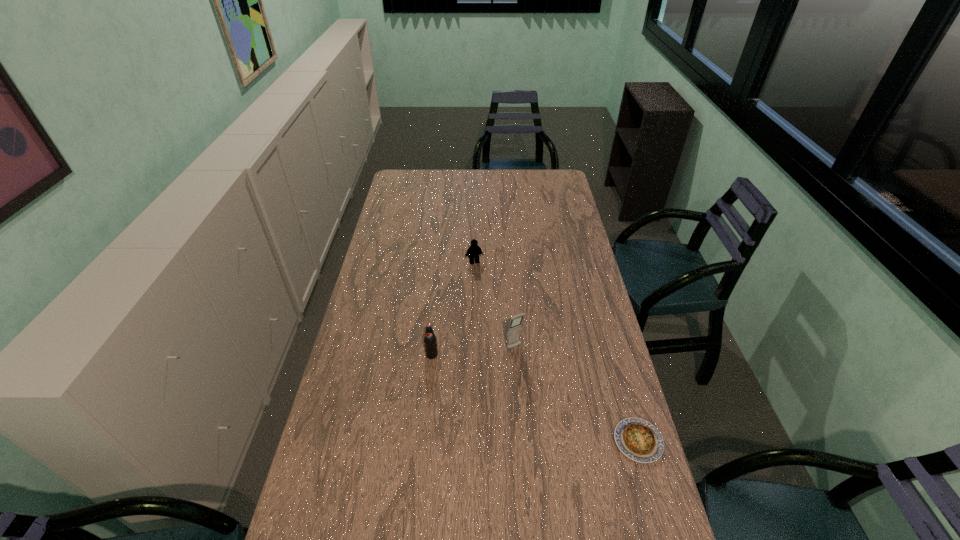
In the image, there is a desktop. Identify the location of free space at the far right corner. Image resolution: width=960 pixels, height=540 pixels. (564, 188).

Locate an element on the screen. This screenshot has width=960, height=540. vacant space that is in between the cellular telephone and the leftmost object is located at coordinates (473, 351).

The image size is (960, 540). In order to click on empty space that is in between the leftmost object and the shortest object in this screenshot , I will do `click(535, 398)`.

You are a GUI agent. You are given a task and a screenshot of the screen. Output one action in this format:
    pyautogui.click(x=<x>, y=<y>)
    Task: Click on the free area in between the rightmost object and the second tallest object
    This screenshot has width=960, height=540.
    Given the screenshot: What is the action you would take?
    pyautogui.click(x=535, y=398)

This screenshot has width=960, height=540. I want to click on empty space that is in between the nearest object and the pop, so click(535, 398).

Locate an element on the screen. The width and height of the screenshot is (960, 540). free point between the leftmost object and the second object from right to left is located at coordinates pyautogui.click(x=473, y=351).

Identify the location of empty location between the pop and the quiche. (535, 398).

You are a GUI agent. You are given a task and a screenshot of the screen. Output one action in this format:
    pyautogui.click(x=<x>, y=<y>)
    Task: Click on the vacant area that lies between the third object from right to left and the cellular telephone
    The width and height of the screenshot is (960, 540).
    Given the screenshot: What is the action you would take?
    pyautogui.click(x=494, y=305)

Identify the location of vacant space in between the quiche and the third tallest object. The width and height of the screenshot is (960, 540). (556, 352).

This screenshot has height=540, width=960. Find the location of `unoccupied area between the leftmost object and the nearest object`. unoccupied area between the leftmost object and the nearest object is located at coordinates (535, 398).